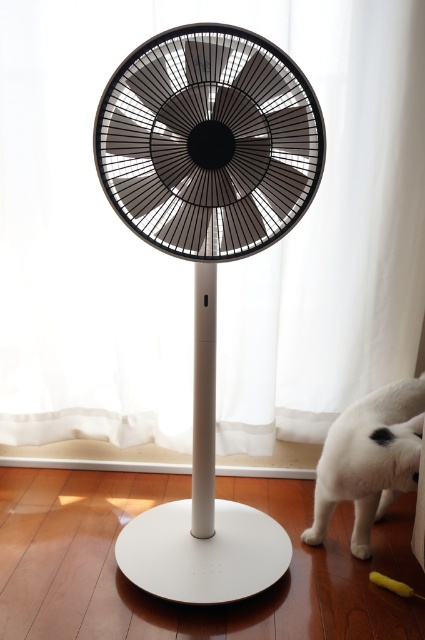
You are a photographer setting up a shoot in the room. You need to position the black matte fan at center and the white fur cat at lower right in such a way that both are clearly visible in the frame. Considering their sizes, which object should be placed closer to the camera to maintain their visibility?

The white fur cat at lower right should be placed closer to the camera because it is smaller in size than the black matte fan at center. This ensures both objects appear similarly sized in the photograph.